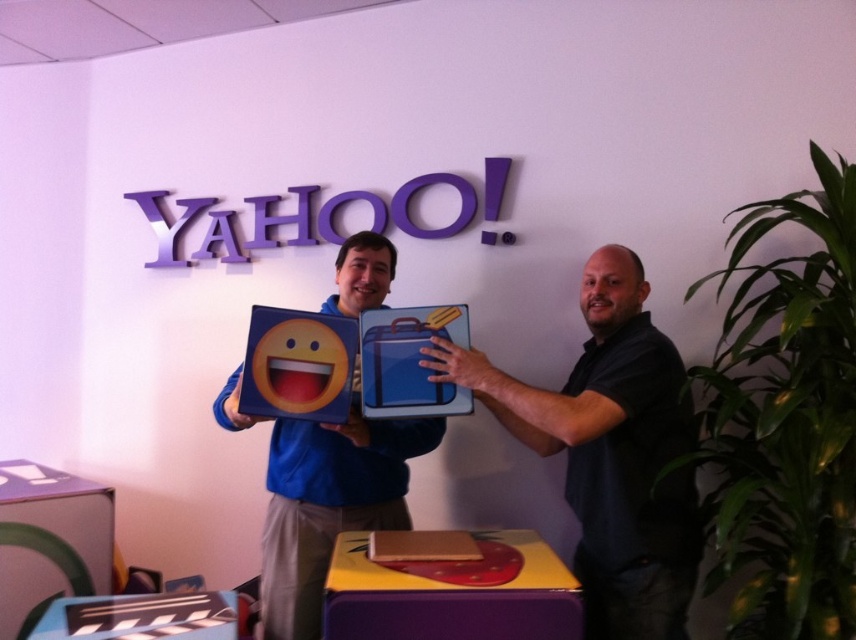
Who is more forward, (22, 620) or (367, 342)?

Point (367, 342)

Image resolution: width=856 pixels, height=640 pixels. I want to click on matte cardboard box at lower left, so click(49, 541).

Locate an element on the screen. matte cardboard box at lower left is located at coordinates coord(49,541).

Which of these two, purple matte box at center or blue fabric suitcase at center, stands shorter?

Standing shorter between the two is purple matte box at center.

Is purple matte box at center below blue fabric suitcase at center?

Yes.

Does point (337, 573) come behind point (468, 328)?

No, (337, 573) is in front of (468, 328).

Image resolution: width=856 pixels, height=640 pixels. Find the location of `purple matte box at center`. purple matte box at center is located at coordinates (453, 593).

Does dark blue shirt at center appear on the left side of purple matte box at center?

In fact, dark blue shirt at center is to the right of purple matte box at center.

Which is in front, point (652, 337) or point (349, 589)?

Positioned in front is point (349, 589).

At what (x,y) coordinates should I click in order to perform the action: click on dark blue shirt at center. Please return your answer as a coordinate pair (x, y). Looking at the image, I should click on (610, 451).